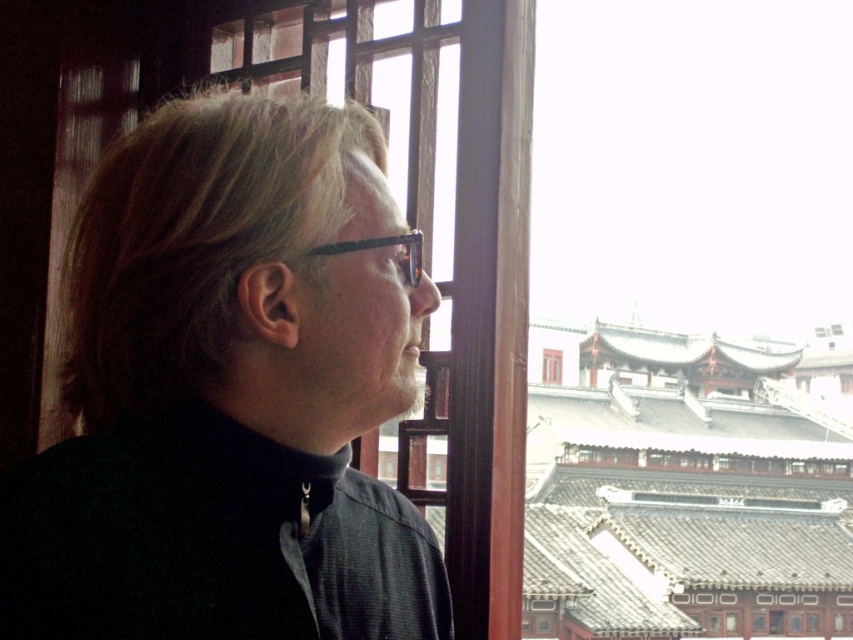
What do you see at coordinates (229, 394) in the screenshot? This screenshot has height=640, width=853. I see `black matte jacket at center` at bounding box center [229, 394].

Is black matte jacket at center above transparent plastic glasses at center?

Actually, black matte jacket at center is below transparent plastic glasses at center.

You are a GUI agent. You are given a task and a screenshot of the screen. Output one action in this format:
    pyautogui.click(x=<x>, y=<y>)
    Task: Click on the black matte jacket at center
    
    Given the screenshot: What is the action you would take?
    pyautogui.click(x=229, y=394)